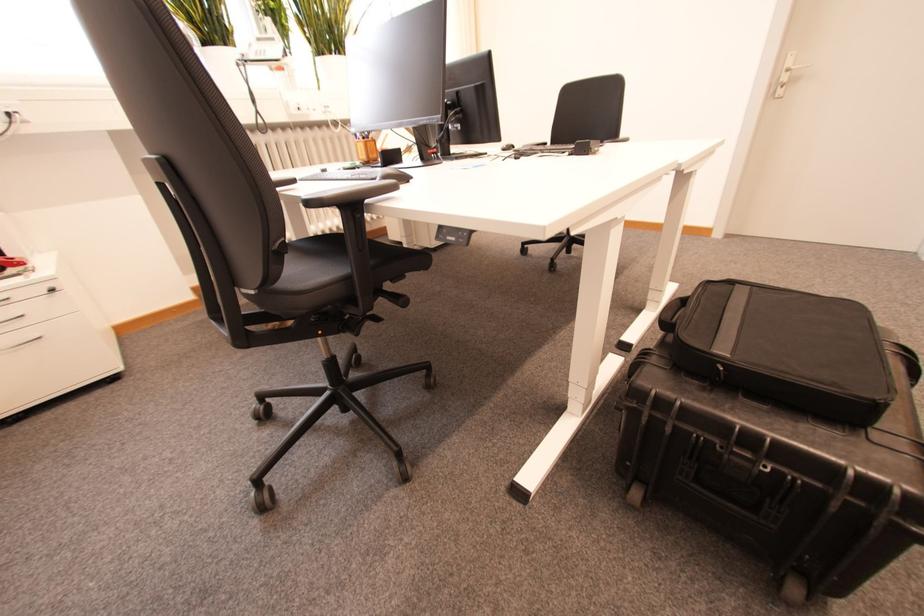
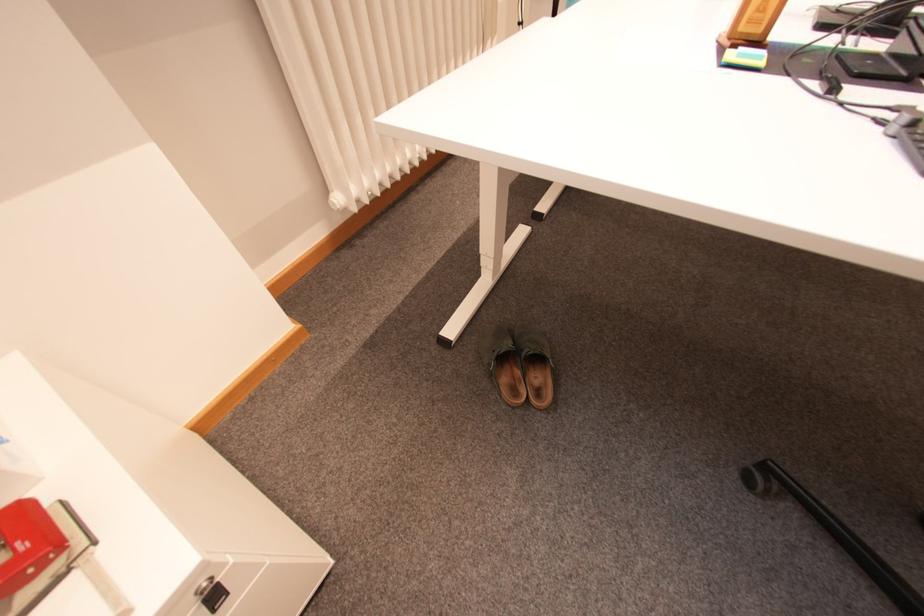
The images are taken continuously from a first-person perspective. In which direction are you moving?

The movement direction of the cameraman is left, forward.